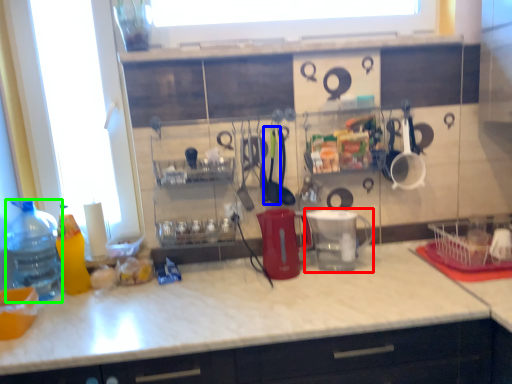
Question: Estimate the real-world distances between objects in this image. Which object is closer to appliance (highlighted by a red box), tableware (highlighted by a blue box) or bottle (highlighted by a green box)?

Choices:
 (A) tableware
 (B) bottle

Answer: (A)